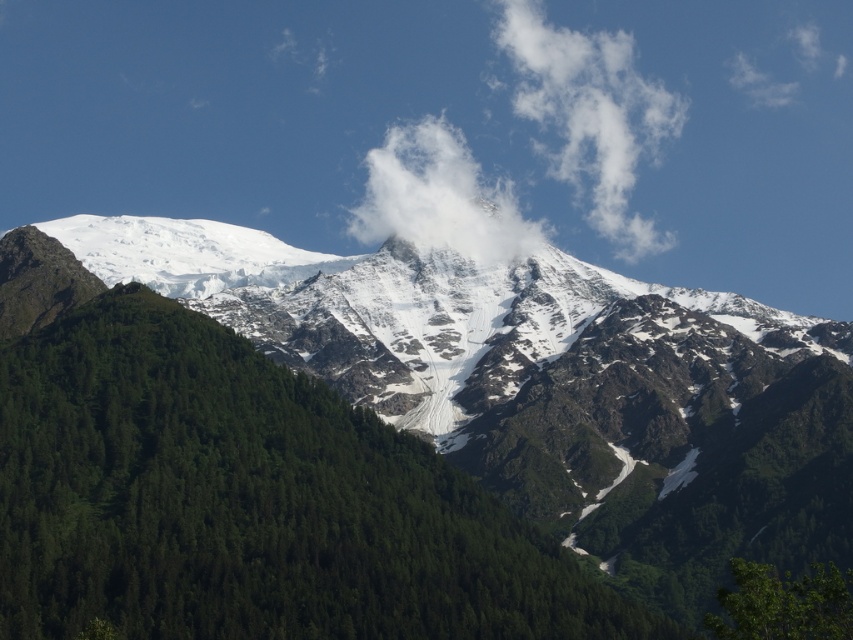
You are standing at the origin point of the coordinate system in the image. Which direction should you move to reach the green matte tree at center?

The green matte tree at center is located at coordinate point 0.784 on the x axis and 0.293 on the y axis. Since you are at the origin, you should move towards the right along the x axis and slightly upwards along the y axis to reach it.

You are a pilot flying an airplane and want to avoid the white fluffy cloud at center. What coordinates should you steer your plane to?

The white fluffy cloud at center is located at coordinates point [439,196]. To avoid it, steer the plane away from those coordinates.